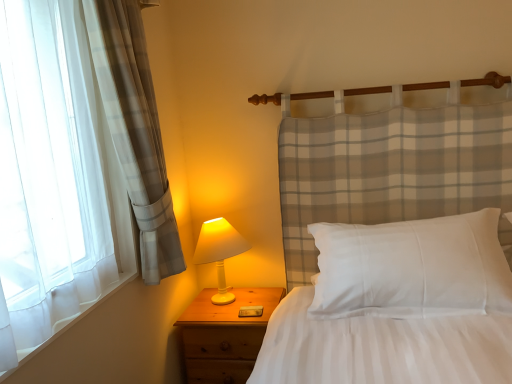
You are a GUI agent. You are given a task and a screenshot of the screen. Output one action in this format:
    pyautogui.click(x=<x>, y=<y>)
    Task: Click on the wooden nightstand at lower left
    Image resolution: width=512 pixels, height=384 pixels.
    Given the screenshot: What is the action you would take?
    pyautogui.click(x=224, y=335)

Would you say wooden nightstand at lower left contains white matte table lamp at lower left?

No, white matte table lamp at lower left is not surrounded by wooden nightstand at lower left.

There is a wooden nightstand at lower left. Identify the location of table lamp above it (from a real-world perspective). This screenshot has width=512, height=384. (219, 252).

Is wooden nightstand at lower left closer to camera compared to white matte table lamp at lower left?

Yes, it is in front of white matte table lamp at lower left.

Does point (243, 372) appear closer or farther from the camera than point (211, 227)?

Clearly, point (243, 372) is closer to the camera than point (211, 227).

Are white matte table lamp at lower left and white cotton pillow at center far apart?

Actually, white matte table lamp at lower left and white cotton pillow at center are a little close together.

Which of these two, white matte table lamp at lower left or white cotton pillow at center, is wider?

Wider between the two is white cotton pillow at center.

Between white matte table lamp at lower left and white cotton pillow at center, which one is positioned in front?

white cotton pillow at center is in front.

Is white matte table lamp at lower left facing away from white cotton pillow at center?

No, white cotton pillow at center is not at the back of white matte table lamp at lower left.

Considering the sizes of objects white matte table lamp at lower left and wooden nightstand at lower left in the image provided, who is bigger, white matte table lamp at lower left or wooden nightstand at lower left?

wooden nightstand at lower left is bigger.

Is white matte table lamp at lower left outside of wooden nightstand at lower left?

Yes, white matte table lamp at lower left is outside of wooden nightstand at lower left.

Is wooden nightstand at lower left at the back of white matte table lamp at lower left?

No.

What's the angular difference between white matte table lamp at lower left and wooden nightstand at lower left's facing directions?

white matte table lamp at lower left and wooden nightstand at lower left are facing 0.349 degrees away from each other.

Which is nearer, (460, 269) or (213, 236)?

Point (460, 269) appears to be closer to the viewer than point (213, 236).

Is white cotton pillow at center not near white matte table lamp at lower left?

white cotton pillow at center is actually quite close to white matte table lamp at lower left.

Between white cotton pillow at center and white matte table lamp at lower left, which one has smaller width?

A: Thinner between the two is white matte table lamp at lower left.

Is white cotton pillow at center facing towards white matte table lamp at lower left?

No, white cotton pillow at center is not oriented towards white matte table lamp at lower left.

From the image's perspective, is wooden nightstand at lower left below white cotton pillow at center?

Indeed, from the image's perspective, wooden nightstand at lower left is shown beneath white cotton pillow at center.

At what (x,y) coordinates should I click in order to perform the action: click on pillow located above the wooden nightstand at lower left (from a real-world perspective). Please return your answer as a coordinate pair (x, y). Looking at the image, I should click on (412, 267).

Does wooden nightstand at lower left appear on the left side of white cotton pillow at center?

Yes, wooden nightstand at lower left is to the left of white cotton pillow at center.

Would you say white cotton pillow at center is part of wooden nightstand at lower left's contents?

Definitely not — white cotton pillow at center is not inside wooden nightstand at lower left.

Is white cotton pillow at center further to camera compared to wooden nightstand at lower left?

No, it is not.

From the image's perspective, relative to wooden nightstand at lower left, is white cotton pillow at center above or below?

white cotton pillow at center is above wooden nightstand at lower left.

I want to click on table lamp on the left of wooden nightstand at lower left, so click(219, 252).

Where is `table lamp below the white cotton pillow at center (from a real-world perspective)`? table lamp below the white cotton pillow at center (from a real-world perspective) is located at coordinates (219, 252).

Considering their positions, is white matte table lamp at lower left positioned further to wooden nightstand at lower left than white cotton pillow at center?

white cotton pillow at center is positioned further to the anchor wooden nightstand at lower left.

Looking at the image, which one is located closer to white cotton pillow at center, wooden nightstand at lower left or white matte table lamp at lower left?

wooden nightstand at lower left is positioned closer to the anchor white cotton pillow at center.

Based on the photo, considering their positions, is white matte table lamp at lower left positioned further to white cotton pillow at center than wooden nightstand at lower left?

white matte table lamp at lower left is further to white cotton pillow at center.

Consider the image. Which object lies nearer to the anchor point white matte table lamp at lower left, wooden nightstand at lower left or white cotton pillow at center?

The object closer to white matte table lamp at lower left is wooden nightstand at lower left.

Estimate the real-world distances between objects in this image. Which object is further from wooden nightstand at lower left, white cotton pillow at center or white matte table lamp at lower left?

The object further to wooden nightstand at lower left is white cotton pillow at center.

Estimate the real-world distances between objects in this image. Which object is closer to white matte table lamp at lower left, white cotton pillow at center or wooden nightstand at lower left?

wooden nightstand at lower left is closer to white matte table lamp at lower left.

Where is `nightstand between white matte table lamp at lower left and white cotton pillow at center from left to right`? nightstand between white matte table lamp at lower left and white cotton pillow at center from left to right is located at coordinates pos(224,335).